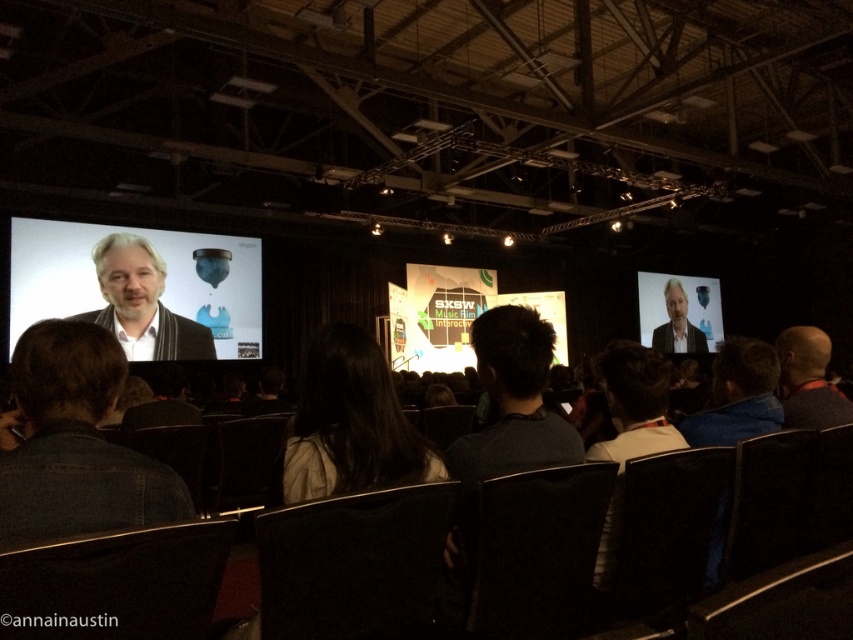
Is dark hair at center thinner than light brown hair at right?

Yes, dark hair at center is thinner than light brown hair at right.

Between dark hair at center and light brown hair at right, which one appears on the left side from the viewer's perspective?

Positioned to the left is dark hair at center.

The height and width of the screenshot is (640, 853). I want to click on dark hair at center, so click(351, 422).

Does point (764, 396) come behind point (672, 305)?

No.

Locate an element on the screen. dark blue shirt at lower right is located at coordinates (737, 396).

Does point (770, 368) come farther from viewer compared to point (671, 291)?

No, (770, 368) is in front of (671, 291).

The height and width of the screenshot is (640, 853). What are the coordinates of `dark blue shirt at lower right` in the screenshot? It's located at (737, 396).

Between dark hair at center and light brown hair at left, which one appears on the right side from the viewer's perspective?

dark hair at center is more to the right.

What do you see at coordinates (351, 422) in the screenshot? Image resolution: width=853 pixels, height=640 pixels. I see `dark hair at center` at bounding box center [351, 422].

Between point (425, 465) and point (138, 307), which one is positioned behind?

Positioned behind is point (138, 307).

Identify the location of dark hair at center. The width and height of the screenshot is (853, 640). (351, 422).